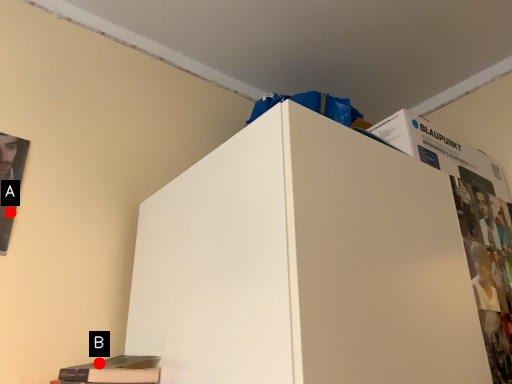
Question: Two points are circled on the image, labeled by A and B beside each circle. Which point is farther from the camera taking this photo?

Choices:
 (A) A is further
 (B) B is further

Answer: (A)